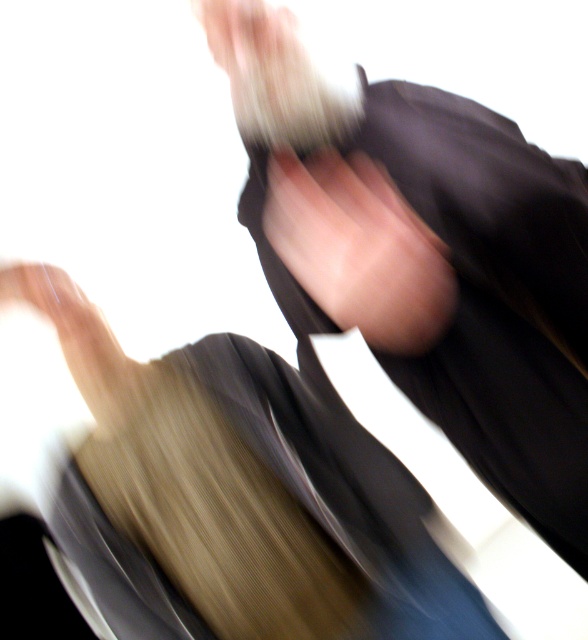
Question: Which point is closer to the camera?

Choices:
 (A) smooth beige hand at lower left
 (B) smooth skin at center

Answer: (B)

Question: Which point appears farthest from the camera in this image?

Choices:
 (A) (103, 333)
 (B) (400, 241)

Answer: (A)

Question: Is smooth skin at center bigger than smooth beige hand at lower left?

Choices:
 (A) yes
 (B) no

Answer: (A)

Question: From the image, what is the correct spatial relationship of smooth skin at center in relation to smooth beige hand at lower left?

Choices:
 (A) below
 (B) above

Answer: (B)

Question: Observing the image, what is the correct spatial positioning of smooth skin at center in reference to smooth beige hand at lower left?

Choices:
 (A) below
 (B) above

Answer: (B)